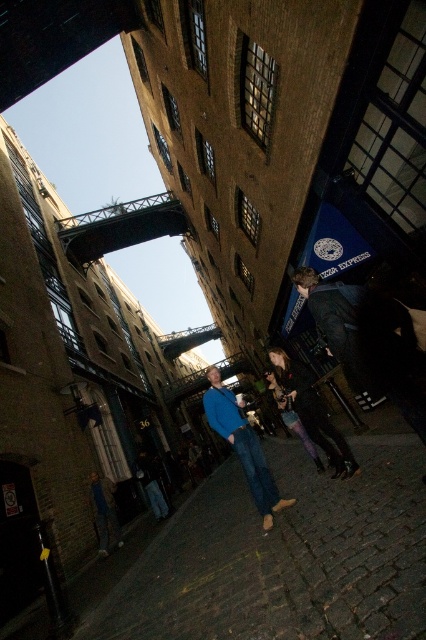
Question: Can you confirm if matte blue sweater at center is bigger than denim pants at center?

Choices:
 (A) no
 (B) yes

Answer: (B)

Question: Can you confirm if dark blue jeans at lower right is smaller than matte blue sweater at center?

Choices:
 (A) no
 (B) yes

Answer: (B)

Question: Among these objects, which one is nearest to the camera?

Choices:
 (A) matte blue sweater at center
 (B) denim pants at center

Answer: (A)

Question: Does matte blue sweater at center have a lesser width compared to denim pants at center?

Choices:
 (A) yes
 (B) no

Answer: (B)

Question: Which of the following is the closest to the observer?

Choices:
 (A) (351, 465)
 (B) (230, 426)
 (C) (402, 333)

Answer: (C)

Question: Which object appears closest to the camera in this image?

Choices:
 (A) matte blue sweater at center
 (B) denim pants at center
 (C) dark blue jeans at lower right

Answer: (C)